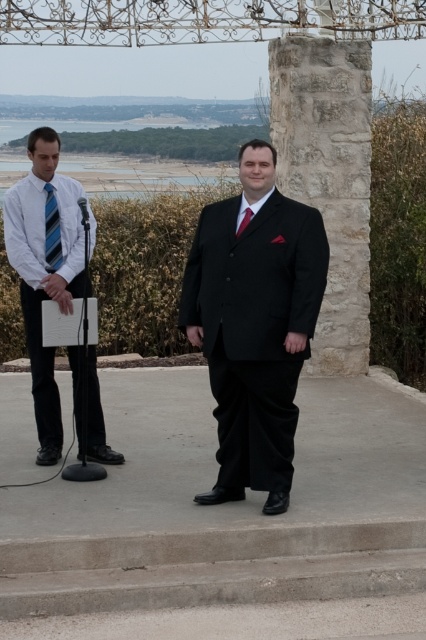
Looking at this image, you are a photographer at a wedding reception. You need to capture a photo of the two men mentioned in the scene. The black satin suit at center and the shiny red tie at center are part of their outfits. Based on their positions, which man should you focus on first to ensure both are in frame?

The black satin suit at center is to the right of the shiny red tie at center. Since the shiny red tie at center is on the left side, you should focus on the man with the shiny red tie at center first to ensure both are in frame as you pan to the right towards the black satin suit at center.

In the scene shown: You are a photographer at a conference and need to capture a photo of both the white striped shirt at left and the shiny red tie at center. Based on their positions, which one is more to the left in the image?

The white striped shirt at left is positioned on the left side of shiny red tie at center, so the white striped shirt at left is more to the left.

You are organizing a charity event and need to decide which item to place on the main stage. The black satin suit at center and the shiny red tie at center are both available. Based on their sizes, which one should you choose if you want a larger item for visual impact?

The black satin suit at center is larger in size than the shiny red tie at center, so you should choose the black satin suit at center for a larger visual impact.